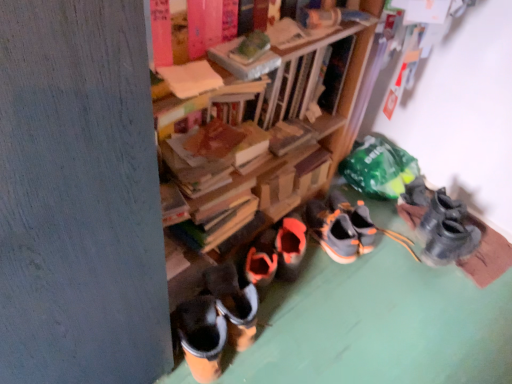
I want to click on free space in front of gray suede sneakers at center, which is the 1th footwear from left to right, so click(x=336, y=280).